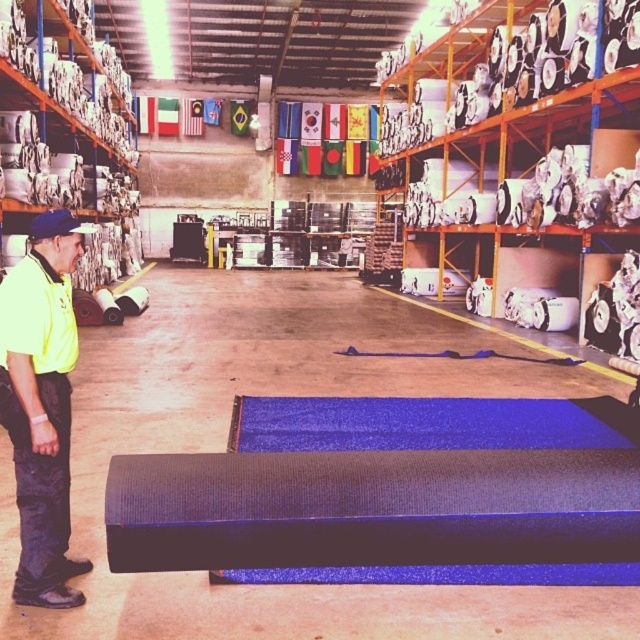
Between matte white fabric at left and yellow fabric uniform at left, which one appears on the left side from the viewer's perspective?

Positioned to the left is matte white fabric at left.

Which of these two, matte white fabric at left or yellow fabric uniform at left, stands taller?

Standing taller between the two is matte white fabric at left.

Between point (42, 152) and point (60, 419), which one is positioned in front?

Point (60, 419)

Locate an element on the screen. The width and height of the screenshot is (640, 640). matte white fabric at left is located at coordinates (67, 132).

Does matte white paper at right appear over matte white fabric at left?

Actually, matte white paper at right is below matte white fabric at left.

Locate an element on the screen. The width and height of the screenshot is (640, 640). matte white paper at right is located at coordinates (522, 147).

You are a GUI agent. You are given a task and a screenshot of the screen. Output one action in this format:
    pyautogui.click(x=<x>, y=<y>)
    Task: Click on the matte white paper at right
    
    Given the screenshot: What is the action you would take?
    pyautogui.click(x=522, y=147)

Does matte white paper at right have a smaller size compared to yellow fabric uniform at left?

Yes, matte white paper at right is smaller than yellow fabric uniform at left.

I want to click on matte white paper at right, so [x=522, y=147].

This screenshot has width=640, height=640. I want to click on matte white paper at right, so click(x=522, y=147).